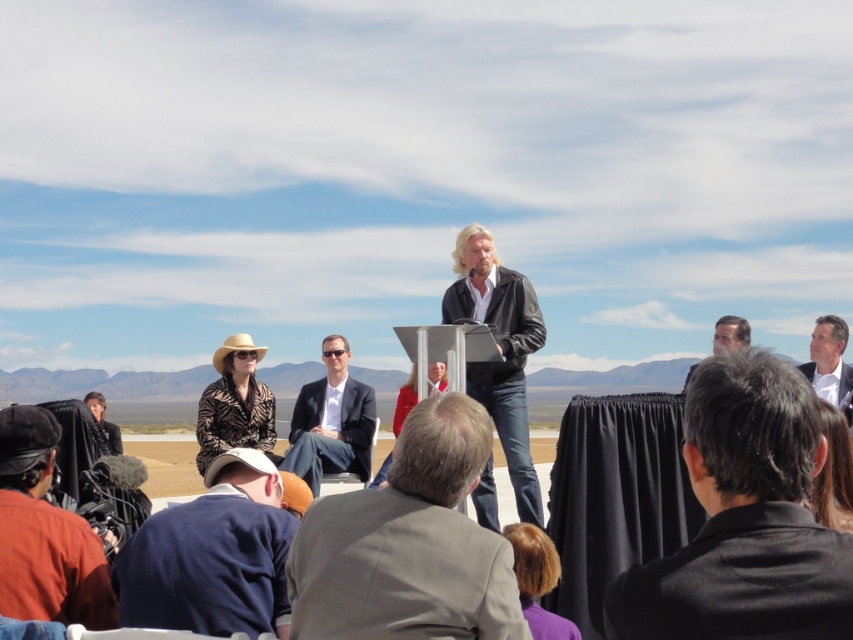
You are standing at the podium facing the audience. There are two points marked in the image. One is at coordinate point (x=397, y=417) and the other at point (x=726, y=324). Which point is closer to you?

Point (x=726, y=324) is closer to you because it is in front of point (x=397, y=417).

You are an event organizer who needs to arrange a photo shoot. You have two items to place in the scene for the photo shoot. The items are the matte red coat at center and the light brown leather jacket at lower right. Which item should you place higher up in the frame to ensure visibility?

The light brown leather jacket at lower right should be placed higher up in the frame because it is taller than the matte red coat at center, making it more visible when elevated.